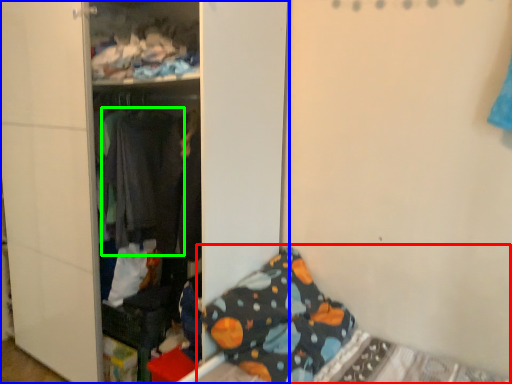
Question: Estimate the real-world distances between objects in this image. Which object is farther from bed (highlighted by a red box), furniture (highlighted by a blue box) or clothing (highlighted by a green box)?

Choices:
 (A) furniture
 (B) clothing

Answer: (B)